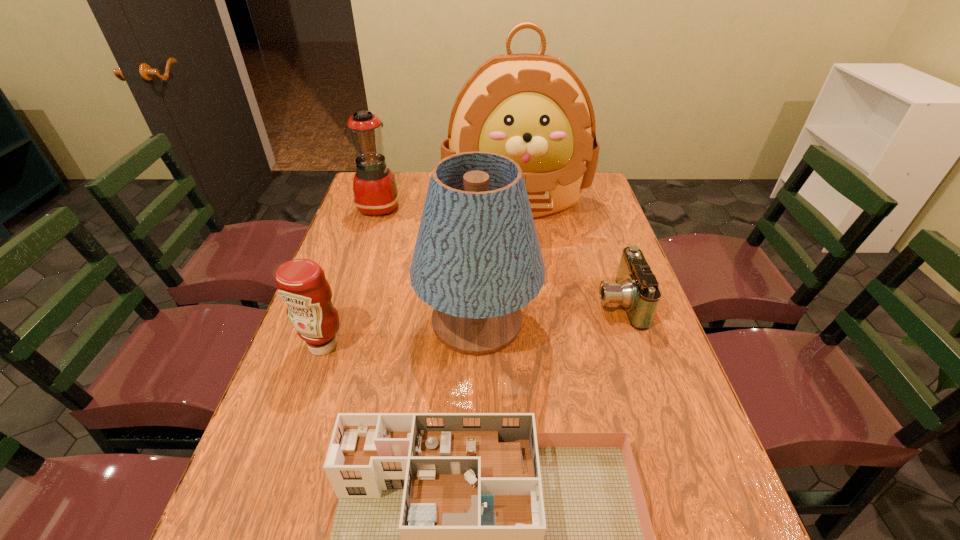
At what (x,y) coordinates should I click in order to perform the action: click on vacant area at the far edge. Please return your answer as a coordinate pair (x, y). The height and width of the screenshot is (540, 960). Looking at the image, I should click on (408, 179).

Locate an element on the screen. This screenshot has height=540, width=960. vacant space at the left edge is located at coordinates (259, 451).

This screenshot has height=540, width=960. In the image, there is a desktop. Identify the location of vacant space at the right edge. (610, 217).

Identify which object is the second nearest to the dollhouse. Please provide its 2D coordinates. Your answer should be formatted as a tuple, i.e. [(x, y)], where the tuple contains the x and y coordinates of a point satisfying the conditions above.

[(301, 283)]

Identify the location of object that can be found as the third closest to the condiment. This screenshot has width=960, height=540. (533, 108).

Find the location of `free spot that satisfies the following two spatial constraints: 1. on the controls of the third tallest object; 2. on the front side of the condiment`. free spot that satisfies the following two spatial constraints: 1. on the controls of the third tallest object; 2. on the front side of the condiment is located at coordinates (334, 345).

Where is `free space that satisfies the following two spatial constraints: 1. on the controls of the fourth shortest object; 2. on the right side of the second tallest object`? This screenshot has width=960, height=540. free space that satisfies the following two spatial constraints: 1. on the controls of the fourth shortest object; 2. on the right side of the second tallest object is located at coordinates (342, 321).

Find the location of `vacant space that satisfies the following two spatial constraints: 1. on the back side of the fifth shortest object; 2. on the right side of the condiment`. vacant space that satisfies the following two spatial constraints: 1. on the back side of the fifth shortest object; 2. on the right side of the condiment is located at coordinates (331, 321).